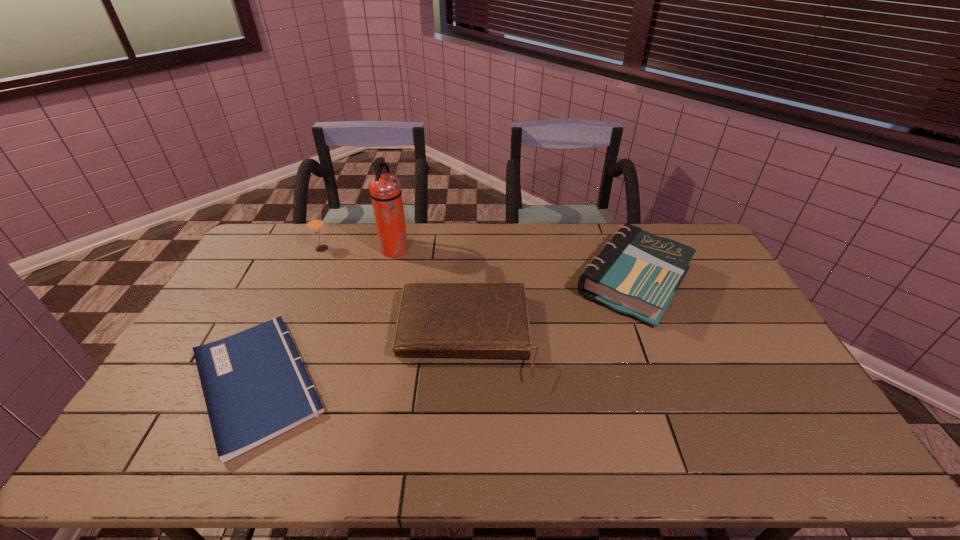
The image size is (960, 540). I want to click on blank space located 0.240m on the left of the straw, so click(x=250, y=248).

This screenshot has height=540, width=960. I want to click on free space located on the left of the third shortest object, so click(473, 282).

Find the location of a particular element. This screenshot has width=960, height=540. free space located 0.140m on the spine side of the second shortest object is located at coordinates (463, 436).

The height and width of the screenshot is (540, 960). Find the location of `vacant region located 0.360m on the right of the shortest object`. vacant region located 0.360m on the right of the shortest object is located at coordinates (467, 382).

The image size is (960, 540). Identify the location of fire extinguisher located at the far edge. (385, 189).

This screenshot has height=540, width=960. Identify the location of straw located in the far edge section of the desktop. (314, 223).

This screenshot has width=960, height=540. What are the coordinates of `paperback book that is at the far edge` in the screenshot? It's located at (637, 273).

You are a GUI agent. You are given a task and a screenshot of the screen. Output one action in this format:
    pyautogui.click(x=<x>, y=<y>)
    Task: Click on the object at the near edge
    This screenshot has height=540, width=960.
    Given the screenshot: What is the action you would take?
    pyautogui.click(x=255, y=386)

The image size is (960, 540). What are the coordinates of `object that is positioned at the left edge` in the screenshot? It's located at (255, 386).

Find the location of a particular element. Image resolution: width=960 pixels, height=540 pixels. object at the right edge is located at coordinates (637, 273).